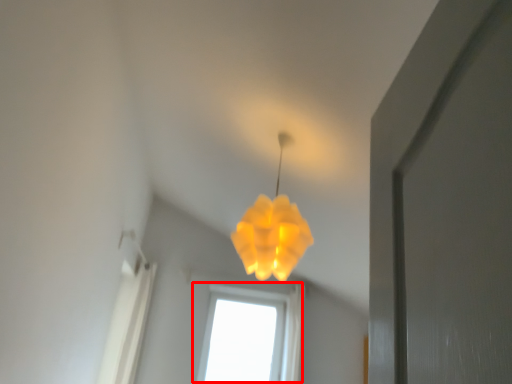
Question: In this image, where is window (annotated by the red box) located relative to lamp?

Choices:
 (A) left
 (B) right

Answer: (A)